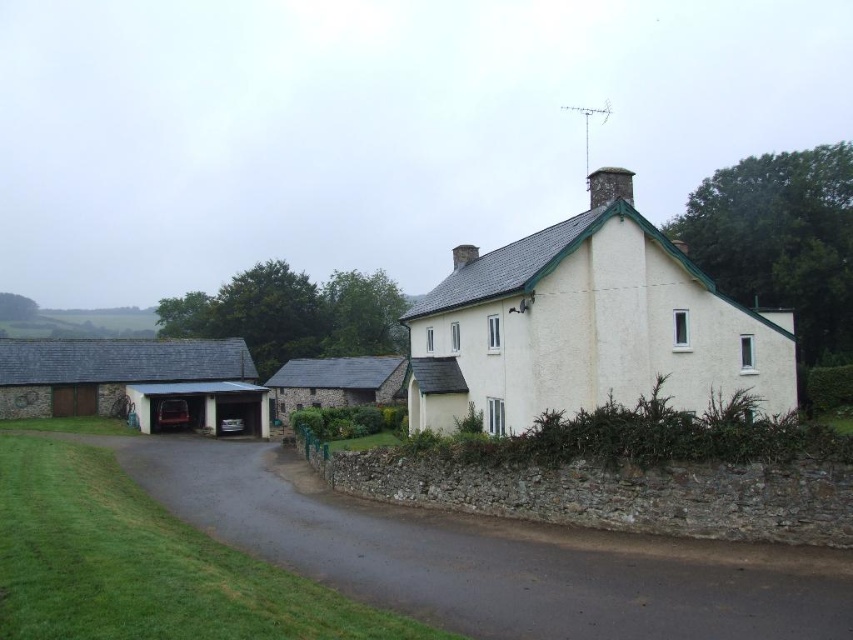
Question: Can you confirm if stone slate roofed garage at left is positioned below dark gray stone chimney at upper center?

Choices:
 (A) no
 (B) yes

Answer: (B)

Question: Does dark gray asphalt at lower center have a larger size compared to white stucco cottage at center?

Choices:
 (A) no
 (B) yes

Answer: (A)

Question: Which object is farther from the camera taking this photo?

Choices:
 (A) dark gray asphalt at lower center
 (B) white stucco cottage at center

Answer: (B)

Question: Which object is positioned farthest from the dark gray asphalt at lower center?

Choices:
 (A) stone slate roofed garage at left
 (B) stone slate roof cottage at center
 (C) white stucco cottage at center

Answer: (B)

Question: Which object appears farthest from the camera in this image?

Choices:
 (A) dark gray stone chimney at upper center
 (B) stone slate roofed garage at left
 (C) dark gray asphalt at lower center
 (D) stone slate roof cottage at center

Answer: (D)

Question: Does white stucco cottage at center have a greater width compared to stone slate roof cottage at center?

Choices:
 (A) no
 (B) yes

Answer: (B)